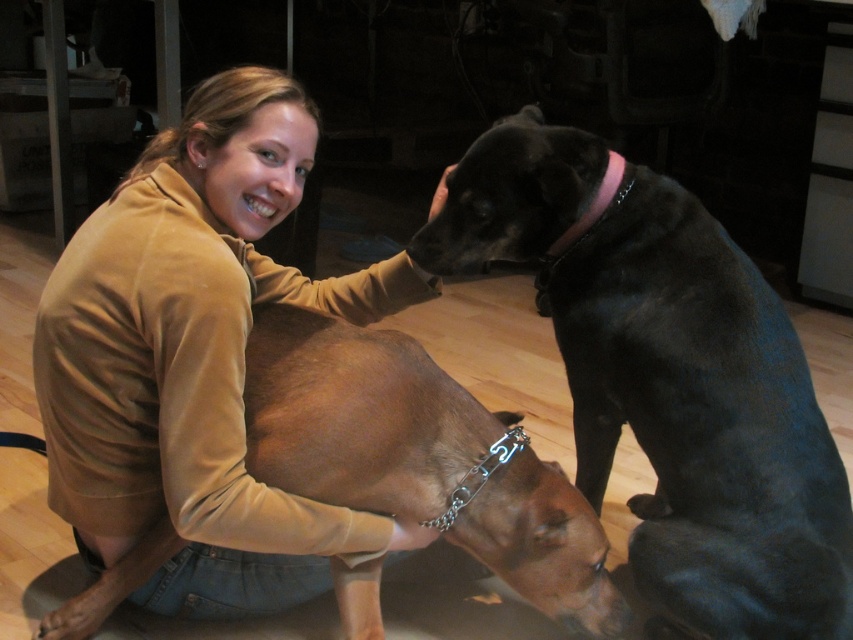
Question: Does black smooth dog at center have a lesser width compared to brown leather dog at center?

Choices:
 (A) yes
 (B) no

Answer: (B)

Question: Which point is closer to the camera?

Choices:
 (A) (572, 140)
 (B) (231, 211)
 (C) (299, 468)
 (D) (624, 196)

Answer: (B)

Question: Is matte brown jacket at center smaller than pink fabric neckband at upper right?

Choices:
 (A) yes
 (B) no

Answer: (B)

Question: Among these points, which one is farthest from the camera?

Choices:
 (A) (245, 108)
 (B) (723, 364)
 (C) (579, 218)

Answer: (C)

Question: Which point is closer to the camera taking this photo?

Choices:
 (A) (486, 547)
 (B) (260, 579)
 (C) (483, 160)

Answer: (A)

Question: In this image, where is brown leather dog at center located relative to pink fabric neckband at upper right?

Choices:
 (A) above
 (B) below

Answer: (B)